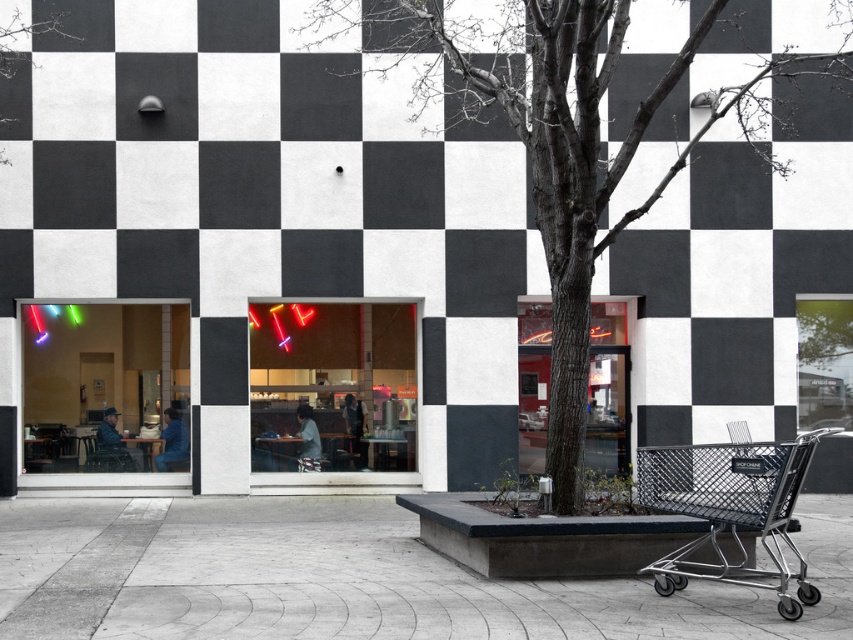
Does concrete at center have a greater height compared to metallic silver shopping cart at lower right?

Incorrect, concrete at center's height is not larger of metallic silver shopping cart at lower right's.

Measure the distance between concrete at center and metallic silver shopping cart at lower right.

5.97 feet

Where is `concrete at center`? concrete at center is located at coordinates (347, 577).

Who is positioned more to the right, concrete at center or dark brown bark tree at center?

From the viewer's perspective, dark brown bark tree at center appears more on the right side.

Does concrete at center appear over dark brown bark tree at center?

No.

Identify the location of concrete at center. (347, 577).

Where is `concrete at center`? concrete at center is located at coordinates (347, 577).

From the picture: Who is higher up, dark brown bark tree at center or metallic silver shopping cart at lower right?

Positioned higher is dark brown bark tree at center.

Which is more to the left, dark brown bark tree at center or metallic silver shopping cart at lower right?

dark brown bark tree at center

Describe the element at coordinates (572, 131) in the screenshot. I see `dark brown bark tree at center` at that location.

Where is `dark brown bark tree at center`? The image size is (853, 640). dark brown bark tree at center is located at coordinates (572, 131).